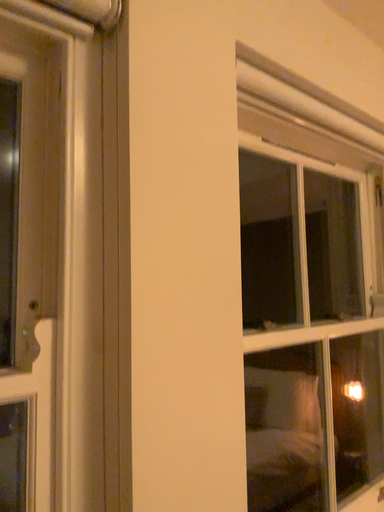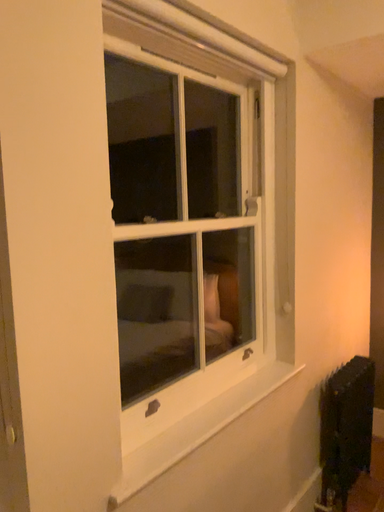
Question: How did the camera likely rotate when shooting the video?

Choices:
 (A) rotated downward
 (B) rotated upward

Answer: (A)